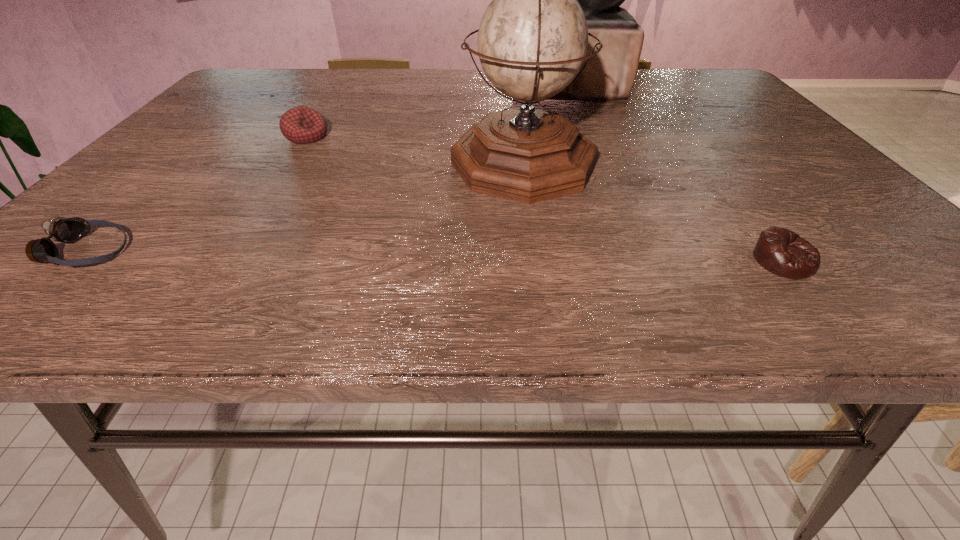
I want to click on free spot between the leftmost object and the third shortest object, so click(x=197, y=194).

I want to click on vacant point located between the farther beanbag and the farthest object, so click(x=439, y=112).

I want to click on vacant area that lies between the goggles and the globe, so coord(305,208).

The image size is (960, 540). Identify the location of vacant area that lies between the farther beanbag and the farthest object. (439, 112).

Locate an element on the screen. empty space between the sculpture and the shorter beanbag is located at coordinates (678, 174).

Locate an element on the screen. The image size is (960, 540). free space between the second tallest object and the rightmost object is located at coordinates (654, 212).

Locate an element on the screen. Image resolution: width=960 pixels, height=540 pixels. free space between the shorter beanbag and the globe is located at coordinates (654, 212).

Identify the location of object that is the fourth closest to the goggles. (780, 251).

I want to click on the fourth closest object relative to the third tallest object, so (780, 251).

You are a GUI agent. You are given a task and a screenshot of the screen. Output one action in this format:
    pyautogui.click(x=<x>, y=<y>)
    Task: Click on the vacant space that satisfies the following two spatial constraints: 1. in a relaxed pose on the farthest object; 2. on the left side of the rightmost object
    The height and width of the screenshot is (540, 960).
    Given the screenshot: What is the action you would take?
    [x=642, y=261]